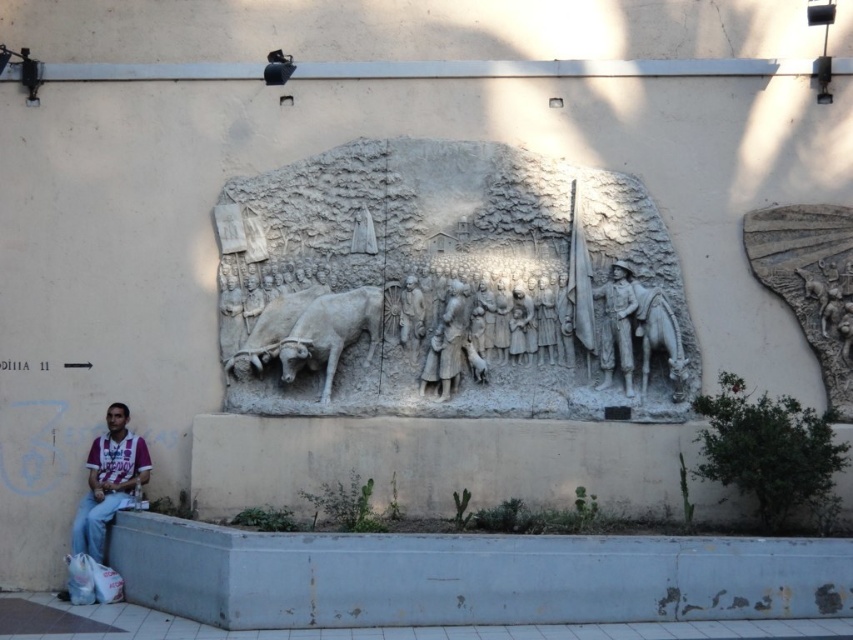
Can you confirm if maroon jersey at lower left is thinner than gray stone horse at center?

No.

The width and height of the screenshot is (853, 640). What do you see at coordinates (109, 481) in the screenshot?
I see `maroon jersey at lower left` at bounding box center [109, 481].

What are the coordinates of `maroon jersey at lower left` in the screenshot? It's located at (109, 481).

Can you confirm if stone figure at center is taller than gray stone figures at center?

Yes, stone figure at center is taller than gray stone figures at center.

Which of these two, stone figure at center or gray stone figures at center, stands taller?

stone figure at center is taller.

Who is more distant from viewer, (x=607, y=372) or (x=456, y=355)?

Point (x=607, y=372)

You are a GUI agent. You are given a task and a screenshot of the screen. Output one action in this format:
    pyautogui.click(x=<x>, y=<y>)
    Task: Click on the stone figure at center
    This screenshot has width=853, height=640.
    Given the screenshot: What is the action you would take?
    pyautogui.click(x=616, y=326)

Looking at this image, is white stone relief at center behind white stone cow at center?

That is True.

Can you confirm if white stone relief at center is smaller than white stone cow at center?

Actually, white stone relief at center might be larger than white stone cow at center.

Does point (519, 280) lie behind point (379, 317)?

Yes, point (519, 280) is behind point (379, 317).

At what (x,y) coordinates should I click in order to perform the action: click on white stone relief at center. Please return your answer as a coordinate pair (x, y). Image resolution: width=853 pixels, height=640 pixels. Looking at the image, I should click on (445, 285).